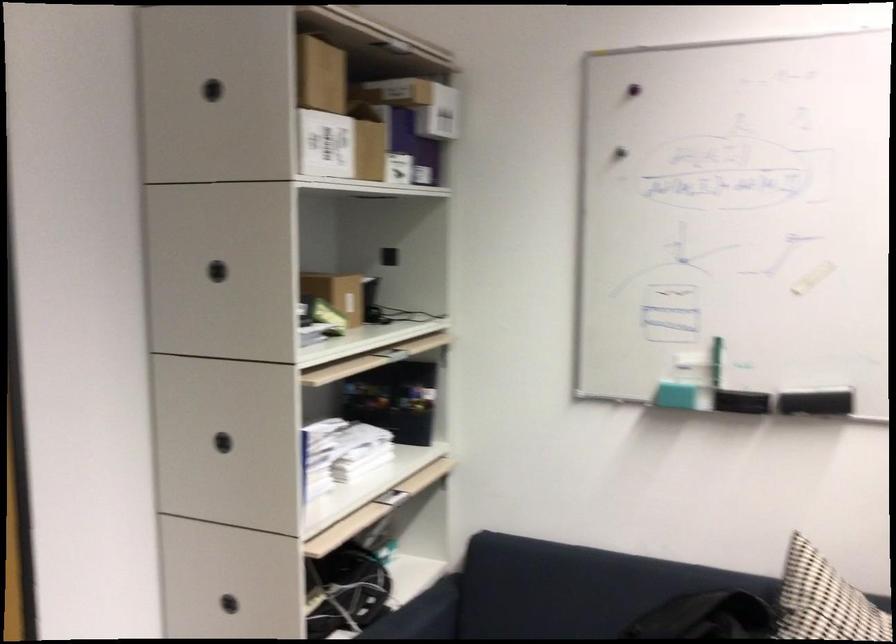
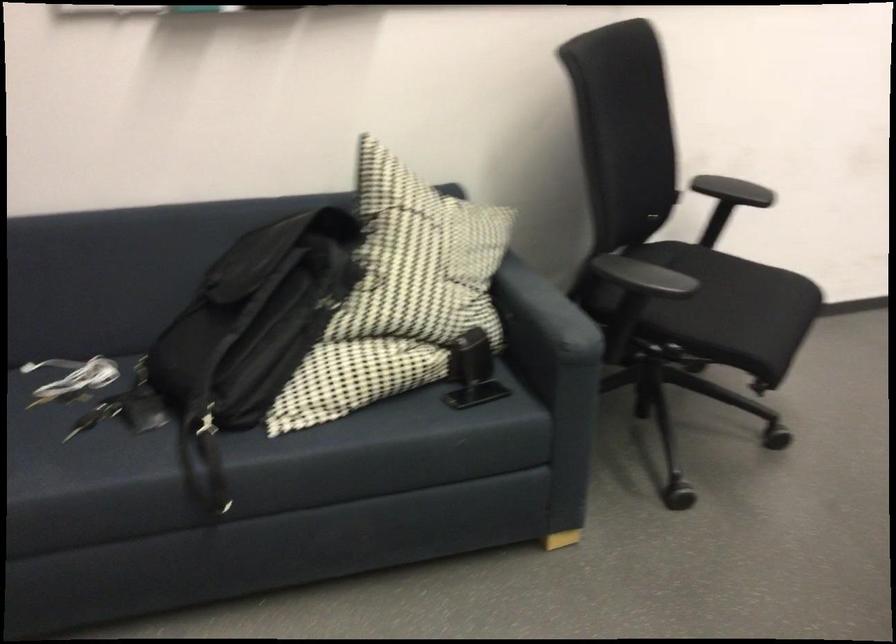
The first image is from the beginning of the video and the second image is from the end. How did the camera likely rotate when shooting the video?

The camera rotated toward right-down.